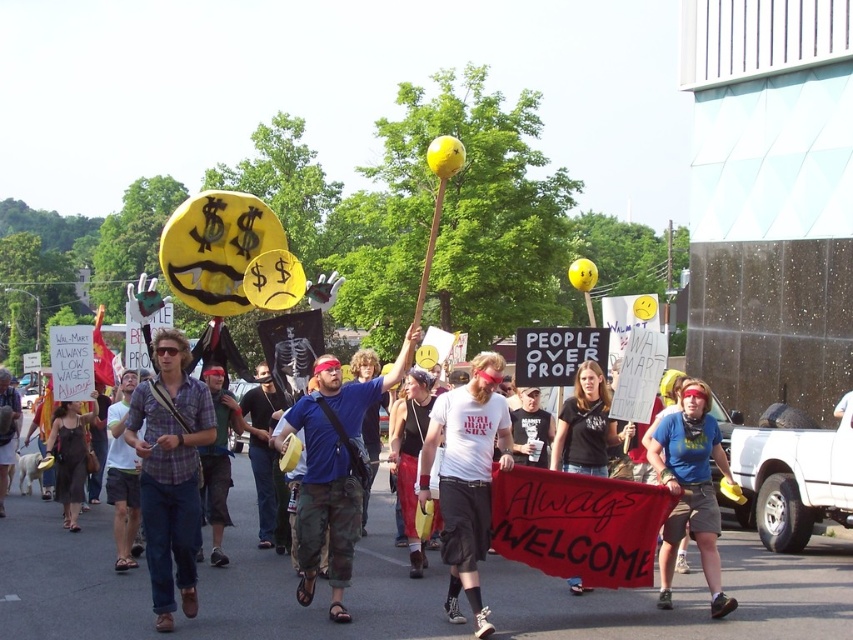
Measure the distance between point (360, 416) and camera.

A distance of 15.77 meters exists between point (360, 416) and camera.

What do you see at coordinates (334, 468) in the screenshot? I see `camouflage pants at center` at bounding box center [334, 468].

Where is `camouflage pants at center`? camouflage pants at center is located at coordinates (334, 468).